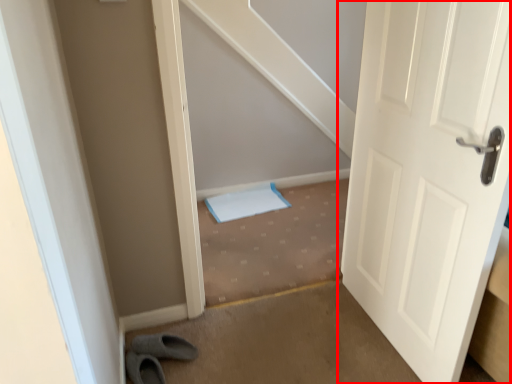
Question: From the image, what is the correct spatial relationship of door (annotated by the red box) in relation to stairwell?

Choices:
 (A) right
 (B) left

Answer: (A)